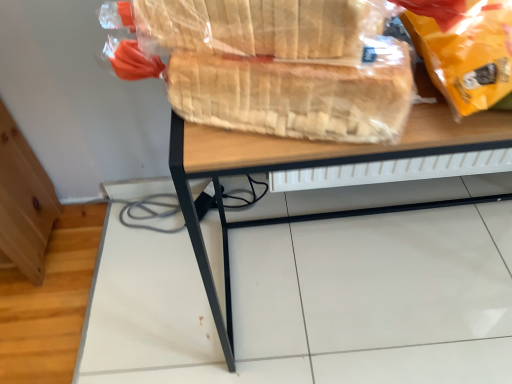
Measure the distance between translucent plastic bread at upper center, the second bread ordered from the bottom, and camera.

translucent plastic bread at upper center, the second bread ordered from the bottom, is 16.76 inches away from camera.

The width and height of the screenshot is (512, 384). Describe the element at coordinates (257, 26) in the screenshot. I see `translucent plastic bread at upper center, the second bread ordered from the bottom` at that location.

What do you see at coordinates (465, 49) in the screenshot?
I see `matte yellow plastic bag at upper right` at bounding box center [465, 49].

Measure the distance between point (255, 75) and camera.

Point (255, 75) and camera are 18.90 inches apart from each other.

Where is `translucent plastic bread at center, placed as the first bread when sorted from bottom to top`? translucent plastic bread at center, placed as the first bread when sorted from bottom to top is located at coordinates click(298, 94).

This screenshot has width=512, height=384. Find the location of `wooden desk at center`. wooden desk at center is located at coordinates (313, 167).

Does translucent plastic bread at center, the 2th bread from the top, appear on the left side of translucent plastic bread at upper center, acting as the first bread starting from the top?

Yes.

From a real-world perspective, is translucent plastic bread at center, placed as the first bread when sorted from bottom to top, under translucent plastic bread at upper center, acting as the first bread starting from the top?

Yes, from a real-world perspective, translucent plastic bread at center, placed as the first bread when sorted from bottom to top, is beneath translucent plastic bread at upper center, acting as the first bread starting from the top.

Is translucent plastic bread at center, the 2th bread from the top, next to translucent plastic bread at upper center, acting as the first bread starting from the top?

Yes, translucent plastic bread at center, the 2th bread from the top, and translucent plastic bread at upper center, acting as the first bread starting from the top, clearly make contact.

In the image, is translucent plastic bread at center, the 2th bread from the top, positioned in front of or behind translucent plastic bread at upper center, the second bread ordered from the bottom?

In the image, translucent plastic bread at center, the 2th bread from the top, appears behind translucent plastic bread at upper center, the second bread ordered from the bottom.

Visually, is translucent plastic bread at center, the 2th bread from the top, positioned to the left or to the right of wooden desk at center?

Based on their positions, translucent plastic bread at center, the 2th bread from the top, is located to the left of wooden desk at center.

From a real-world perspective, is translucent plastic bread at center, the 2th bread from the top, on wooden desk at center?

Yes, from a real-world perspective, translucent plastic bread at center, the 2th bread from the top, is above wooden desk at center.

You are a GUI agent. You are given a task and a screenshot of the screen. Output one action in this format:
    pyautogui.click(x=<x>, y=<y>)
    Task: Click on the 2nd bread to the left when counting from the wooden desk at center
    This screenshot has width=512, height=384.
    Given the screenshot: What is the action you would take?
    pyautogui.click(x=298, y=94)

Is translucent plastic bread at upper center, the second bread ordered from the bottom, in contact with translucent plastic bread at center, the 2th bread from the top?

Yes, translucent plastic bread at upper center, the second bread ordered from the bottom, and translucent plastic bread at center, the 2th bread from the top, clearly make contact.

Is translucent plastic bread at center, the 2th bread from the top, located within translucent plastic bread at upper center, acting as the first bread starting from the top?

Actually, translucent plastic bread at center, the 2th bread from the top, is outside translucent plastic bread at upper center, acting as the first bread starting from the top.

Could you tell me if translucent plastic bread at upper center, the second bread ordered from the bottom, is facing translucent plastic bread at center, the 2th bread from the top?

No.

Could you tell me if wooden desk at center is turned towards translucent plastic bread at upper center, acting as the first bread starting from the top?

No, wooden desk at center does not turn towards translucent plastic bread at upper center, acting as the first bread starting from the top.

Is wooden desk at center not near translucent plastic bread at upper center, the second bread ordered from the bottom?

They are positioned close to each other.

Consider the image. Measure the distance from wooden desk at center to translucent plastic bread at upper center, acting as the first bread starting from the top.

13.23 inches.

Consider the image. From the image's perspective, is translucent plastic bread at upper center, acting as the first bread starting from the top, on wooden desk at center?

Yes.

From the image's perspective, count 2nd breads upward from the wooden desk at center and point to it. Please provide its 2D coordinates.

[(257, 26)]

Which of these two, translucent plastic bread at upper center, acting as the first bread starting from the top, or wooden desk at center, stands taller?

wooden desk at center.

Is the position of translucent plastic bread at upper center, acting as the first bread starting from the top, more distant than that of wooden desk at center?

No, translucent plastic bread at upper center, acting as the first bread starting from the top, is in front of wooden desk at center.

Could you tell me if wooden desk at center is facing translucent plastic bread at center, the 2th bread from the top?

No, wooden desk at center does not turn towards translucent plastic bread at center, the 2th bread from the top.

Locate an element on the screen. The height and width of the screenshot is (384, 512). the 2nd bread counting from the left of the wooden desk at center is located at coordinates (298, 94).

Is wooden desk at center far away from translucent plastic bread at center, the 2th bread from the top?

No, wooden desk at center is not far away from translucent plastic bread at center, the 2th bread from the top.

Which object is thinner, wooden desk at center or translucent plastic bread at center, placed as the first bread when sorted from bottom to top?

With smaller width is translucent plastic bread at center, placed as the first bread when sorted from bottom to top.

From a real-world perspective, between matte yellow plastic bag at upper right and translucent plastic bread at center, the 2th bread from the top, who is vertically lower?

translucent plastic bread at center, the 2th bread from the top, is physically lower.

Between matte yellow plastic bag at upper right and translucent plastic bread at center, the 2th bread from the top, which one appears on the right side from the viewer's perspective?

Positioned to the right is matte yellow plastic bag at upper right.

From the image's perspective, between matte yellow plastic bag at upper right and translucent plastic bread at center, placed as the first bread when sorted from bottom to top, which one is located above?

matte yellow plastic bag at upper right, from the image's perspective.

Is matte yellow plastic bag at upper right positioned in front of translucent plastic bread at center, placed as the first bread when sorted from bottom to top?

Yes, matte yellow plastic bag at upper right is closer to the viewer.

Image resolution: width=512 pixels, height=384 pixels. Find the location of `bread above the translucent plastic bread at center, placed as the first bread when sorted from bottom to top (from a real-world perspective)`. bread above the translucent plastic bread at center, placed as the first bread when sorted from bottom to top (from a real-world perspective) is located at coordinates (257, 26).

At what (x,y) coordinates should I click in order to perform the action: click on bread that is the 1st one when counting forward from the wooden desk at center. Please return your answer as a coordinate pair (x, y). The width and height of the screenshot is (512, 384). Looking at the image, I should click on pos(298,94).

Based on their spatial positions, is translucent plastic bread at upper center, the second bread ordered from the bottom, or wooden desk at center closer to translucent plastic bread at center, placed as the first bread when sorted from bottom to top?

Based on the image, translucent plastic bread at upper center, the second bread ordered from the bottom, appears to be nearer to translucent plastic bread at center, placed as the first bread when sorted from bottom to top.

Based on their spatial positions, is wooden desk at center or matte yellow plastic bag at upper right further from translucent plastic bread at center, placed as the first bread when sorted from bottom to top?

The object further to translucent plastic bread at center, placed as the first bread when sorted from bottom to top, is wooden desk at center.

Estimate the real-world distances between objects in this image. Which object is further from wooden desk at center, translucent plastic bread at upper center, acting as the first bread starting from the top, or translucent plastic bread at center, the 2th bread from the top?

Based on the image, translucent plastic bread at upper center, acting as the first bread starting from the top, appears to be further to wooden desk at center.

Which object lies further to the anchor point matte yellow plastic bag at upper right, translucent plastic bread at center, the 2th bread from the top, or translucent plastic bread at upper center, acting as the first bread starting from the top?

Based on the image, translucent plastic bread at upper center, acting as the first bread starting from the top, appears to be further to matte yellow plastic bag at upper right.

Considering their positions, is wooden desk at center positioned closer to translucent plastic bread at center, placed as the first bread when sorted from bottom to top, than translucent plastic bread at upper center, the second bread ordered from the bottom?

The object closer to translucent plastic bread at center, placed as the first bread when sorted from bottom to top, is translucent plastic bread at upper center, the second bread ordered from the bottom.

From the image, which object appears to be nearer to translucent plastic bread at upper center, acting as the first bread starting from the top, matte yellow plastic bag at upper right or wooden desk at center?

matte yellow plastic bag at upper right is positioned closer to the anchor translucent plastic bread at upper center, acting as the first bread starting from the top.

From the image, which object appears to be farther from wooden desk at center, translucent plastic bread at upper center, the second bread ordered from the bottom, or matte yellow plastic bag at upper right?

matte yellow plastic bag at upper right is further to wooden desk at center.

Estimate the real-world distances between objects in this image. Which object is further from matte yellow plastic bag at upper right, translucent plastic bread at upper center, the second bread ordered from the bottom, or wooden desk at center?

Among the two, wooden desk at center is located further to matte yellow plastic bag at upper right.

Identify the location of plastic bag located between translucent plastic bread at upper center, the second bread ordered from the bottom, and wooden desk at center in the left-right direction. This screenshot has width=512, height=384. (465, 49).

Image resolution: width=512 pixels, height=384 pixels. Identify the location of bread between translucent plastic bread at center, the 2th bread from the top, and wooden desk at center from left to right. (257, 26).

Find the location of a particular element. This screenshot has width=512, height=384. plastic bag situated between translucent plastic bread at center, placed as the first bread when sorted from bottom to top, and wooden desk at center from left to right is located at coordinates (465, 49).

Where is `bread situated between translucent plastic bread at center, placed as the first bread when sorted from bottom to top, and matte yellow plastic bag at upper right from left to right`? Image resolution: width=512 pixels, height=384 pixels. bread situated between translucent plastic bread at center, placed as the first bread when sorted from bottom to top, and matte yellow plastic bag at upper right from left to right is located at coordinates (257, 26).